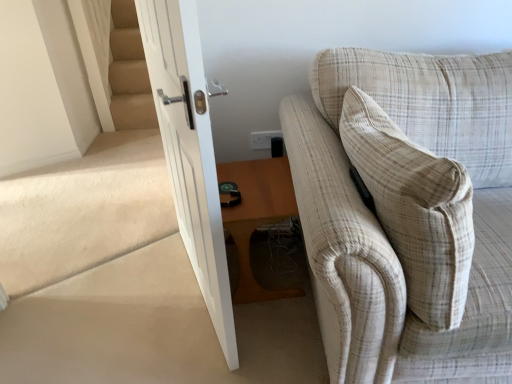
Find the location of `vacant area situated below beige carpeted stairs at left (from a real-world perspective)`. vacant area situated below beige carpeted stairs at left (from a real-world perspective) is located at coordinates (104, 260).